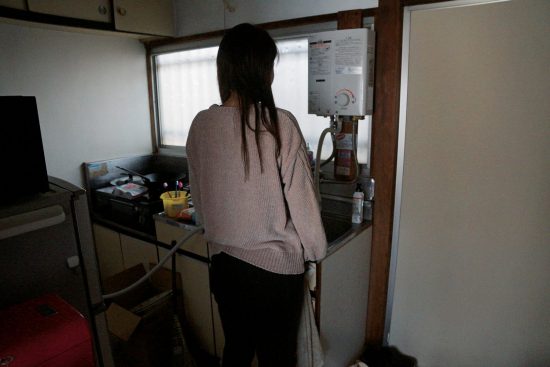
I want to click on curtains, so click(178, 75).